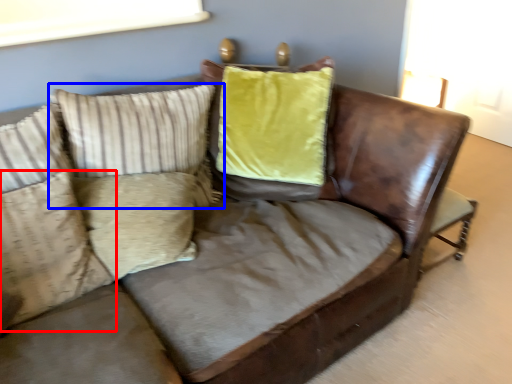
Question: Which point is closer to the camera, pillow (highlighted by a red box) or pillow (highlighted by a blue box)?

Choices:
 (A) pillow
 (B) pillow

Answer: (A)